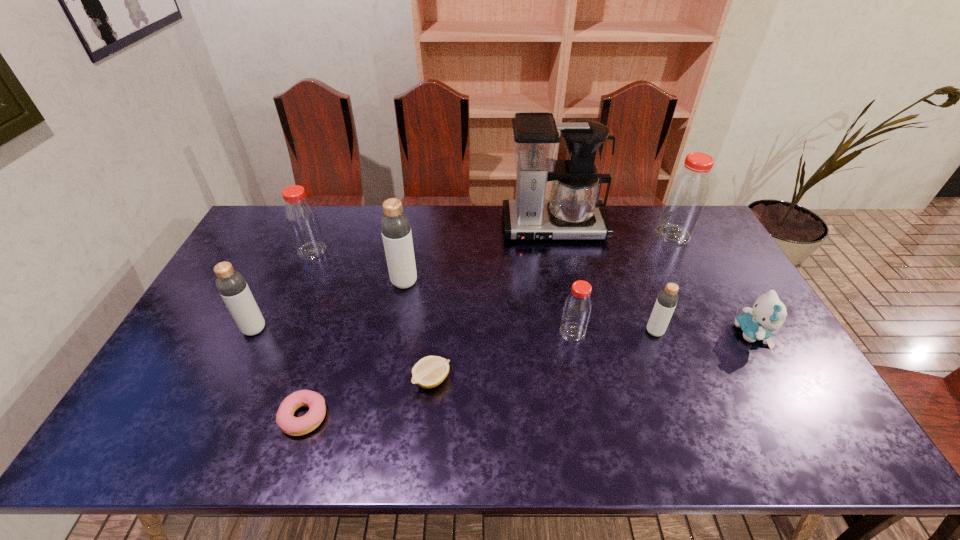
Image resolution: width=960 pixels, height=540 pixels. Find the location of `the tallest object`. the tallest object is located at coordinates click(x=574, y=212).

Locate an element on the screen. coffee maker is located at coordinates (574, 212).

Identify the location of the rightmost bottle. Image resolution: width=960 pixels, height=540 pixels. (685, 200).

Identify the location of the biggest red bottle. Image resolution: width=960 pixels, height=540 pixels. (685, 200).

The height and width of the screenshot is (540, 960). Identify the location of the second gray bottle from left to right. (395, 226).

This screenshot has width=960, height=540. In order to click on the fourth object from left to right in this screenshot , I will do `click(395, 226)`.

The height and width of the screenshot is (540, 960). Find the location of `the second smallest red bottle`. the second smallest red bottle is located at coordinates (302, 220).

Identify the location of the leftmost gray bottle. (232, 286).

In order to click on the smallest red bottle in this screenshot , I will do point(577,307).

Identify the location of the nearest red bottle. The width and height of the screenshot is (960, 540). (577, 307).